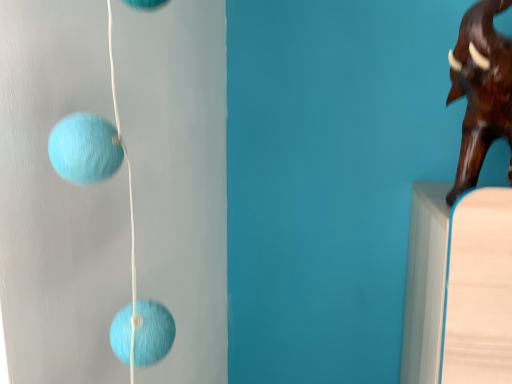
Identify the location of wooden elephant at right. (481, 90).

Describe the element at coordinates (481, 90) in the screenshot. The width and height of the screenshot is (512, 384). I see `wooden elephant at right` at that location.

You are a GUI agent. You are given a task and a screenshot of the screen. Output one action in this format:
    pyautogui.click(x=<x>, y=<y>)
    Task: Click on the wooden elephant at right
    
    Given the screenshot: What is the action you would take?
    pyautogui.click(x=481, y=90)